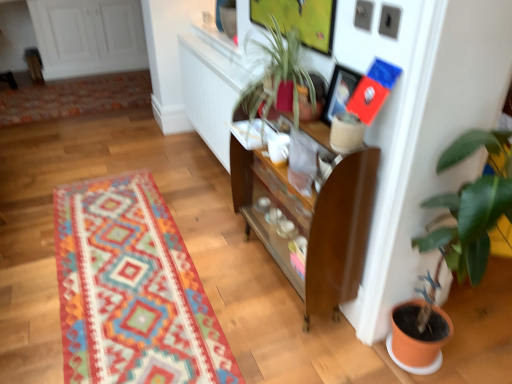
Question: Is multicolored woven rug at center, which ranks as the first mat in front-to-back order, facing towards matte black picture frame at upper center?

Choices:
 (A) no
 (B) yes

Answer: (A)

Question: Is multicolored woven rug at center, which appears as the second mat when viewed from the back, further to the viewer compared to matte black picture frame at upper center?

Choices:
 (A) yes
 (B) no

Answer: (B)

Question: From a real-world perspective, is multicolored woven rug at center, positioned as the 1th mat in bottom-to-top order, located higher than matte black picture frame at upper center?

Choices:
 (A) yes
 (B) no

Answer: (B)

Question: Considering the relative sizes of multicolored woven rug at center, which ranks as the first mat in front-to-back order, and matte black picture frame at upper center in the image provided, is multicolored woven rug at center, which ranks as the first mat in front-to-back order, thinner than matte black picture frame at upper center?

Choices:
 (A) no
 (B) yes

Answer: (A)

Question: Is multicolored woven rug at center, the 2th mat in the top-to-bottom sequence, taller than matte black picture frame at upper center?

Choices:
 (A) yes
 (B) no

Answer: (B)

Question: From the image's perspective, is multicolored woven rug at center, positioned as the 1th mat in bottom-to-top order, over matte black picture frame at upper center?

Choices:
 (A) yes
 (B) no

Answer: (B)

Question: Is white glossy coffee cup at center behind multicolored woven rug at center, which appears as the second mat when viewed from the back?

Choices:
 (A) yes
 (B) no

Answer: (A)

Question: Does white glossy coffee cup at center have a greater width compared to multicolored woven rug at center, which appears as the second mat when viewed from the back?

Choices:
 (A) yes
 (B) no

Answer: (B)

Question: Considering the relative positions of white glossy coffee cup at center and multicolored woven rug at center, the 2th mat in the top-to-bottom sequence, in the image provided, is white glossy coffee cup at center to the left of multicolored woven rug at center, the 2th mat in the top-to-bottom sequence, from the viewer's perspective?

Choices:
 (A) yes
 (B) no

Answer: (B)

Question: From a real-world perspective, is white glossy coffee cup at center beneath multicolored woven rug at center, which ranks as the first mat in front-to-back order?

Choices:
 (A) yes
 (B) no

Answer: (B)

Question: From a real-world perspective, is white glossy coffee cup at center located higher than multicolored woven rug at center, which appears as the second mat when viewed from the back?

Choices:
 (A) yes
 (B) no

Answer: (A)

Question: Considering the relative positions of white glossy coffee cup at center and multicolored woven rug at center, positioned as the 1th mat in bottom-to-top order, in the image provided, is white glossy coffee cup at center to the right of multicolored woven rug at center, positioned as the 1th mat in bottom-to-top order, from the viewer's perspective?

Choices:
 (A) no
 (B) yes

Answer: (B)

Question: From the image's perspective, is white glossy coffee cup at center on top of multicolored woven rug at upper left, marked as the 2th mat in a bottom-to-top arrangement?

Choices:
 (A) no
 (B) yes

Answer: (A)